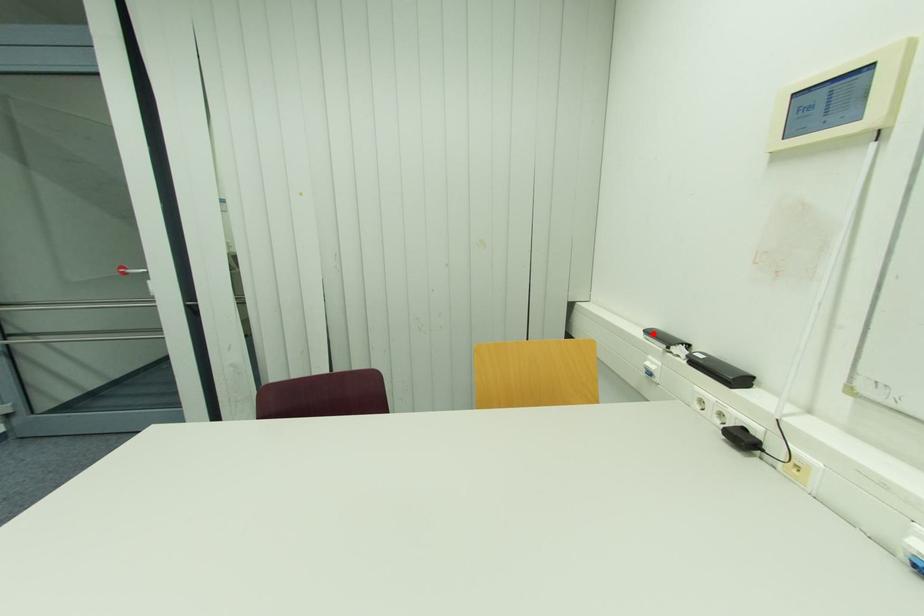
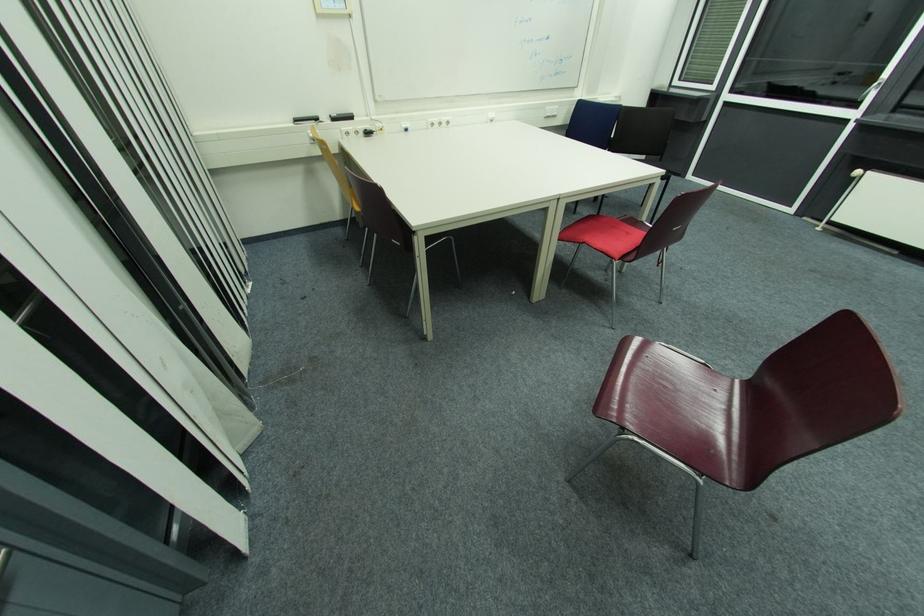
In the second image, find the point that corresponds to the highlighted location in the first image.

(300, 121)